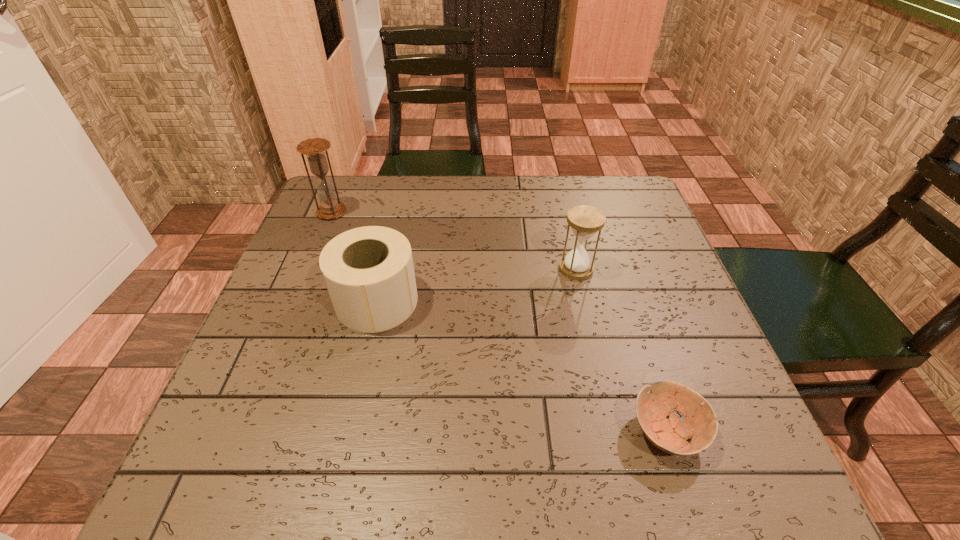
Locate an element on the screen. free space between the second object from left to right and the right hourglass is located at coordinates (476, 285).

This screenshot has width=960, height=540. I want to click on object that is the third closest to the nearest object, so click(x=314, y=148).

Find the location of `object that stands as the closest to the right hourglass`. object that stands as the closest to the right hourglass is located at coordinates (669, 435).

Where is `vacant space that satisfies the following two spatial constraints: 1. on the front side of the nearest object; 2. on the left side of the shorter hourglass`? This screenshot has width=960, height=540. vacant space that satisfies the following two spatial constraints: 1. on the front side of the nearest object; 2. on the left side of the shorter hourglass is located at coordinates (613, 431).